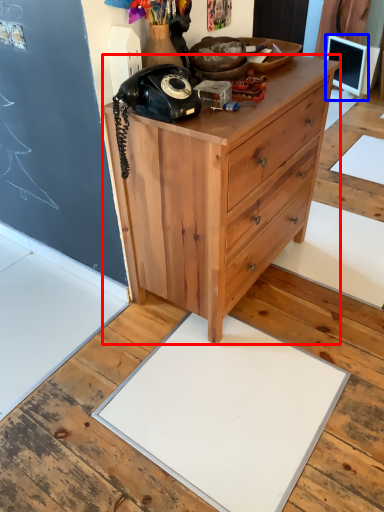
Question: Among these objects, which one is nearest to the camera, chest of drawers (highlighted by a red box) or computer monitor (highlighted by a blue box)?

Choices:
 (A) chest of drawers
 (B) computer monitor

Answer: (A)